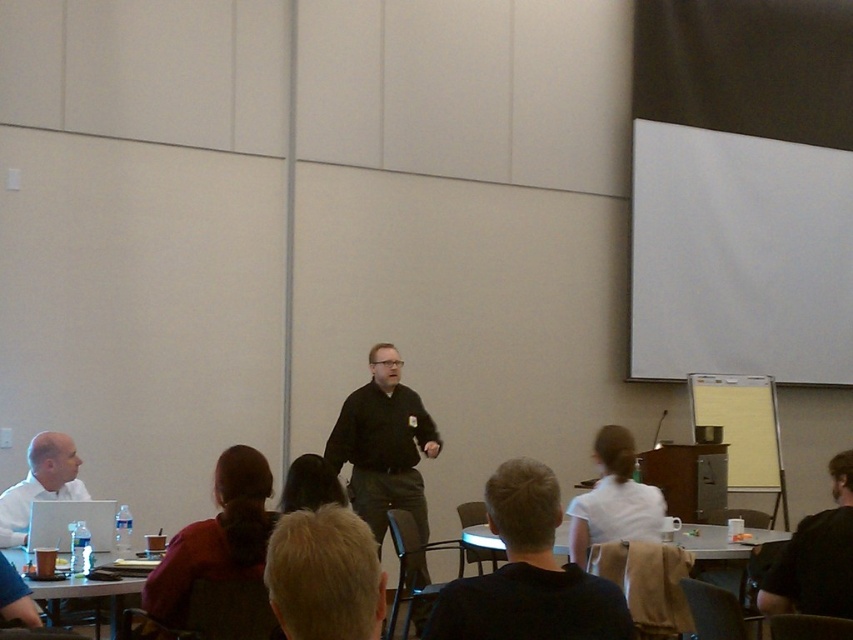
Question: Which point is farther from the camera taking this photo?

Choices:
 (A) (793, 547)
 (B) (51, 436)
 (C) (283, 506)
 (D) (767, 205)

Answer: (D)

Question: Is white cotton shirt at center in front of matte black laptop at left?

Choices:
 (A) no
 (B) yes

Answer: (B)

Question: Which point is farther from the camera taking this photo?

Choices:
 (A) (299, 612)
 (B) (691, 198)

Answer: (B)

Question: Which object is farther from the camera taking this photo?

Choices:
 (A) blonde hair at lower center
 (B) black matte shirt at center

Answer: (B)

Question: Does black matte shirt at center have a lesser width compared to wooden table at lower left?

Choices:
 (A) yes
 (B) no

Answer: (A)

Question: Where is blonde hair at lower center located in relation to black matte shirt at center in the image?

Choices:
 (A) left
 (B) right

Answer: (B)